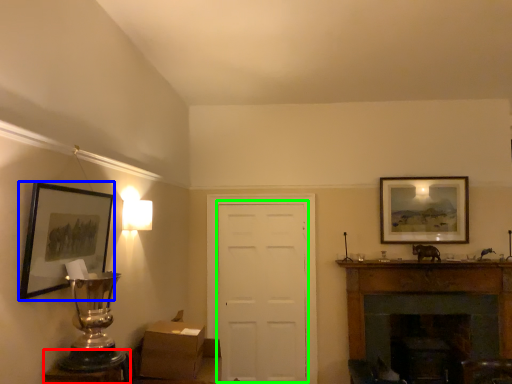
Question: Which object is the closest to the table (highlighted by a red box)? Choose among these: picture frame (highlighted by a blue box) or door (highlighted by a green box).

Choices:
 (A) picture frame
 (B) door

Answer: (A)